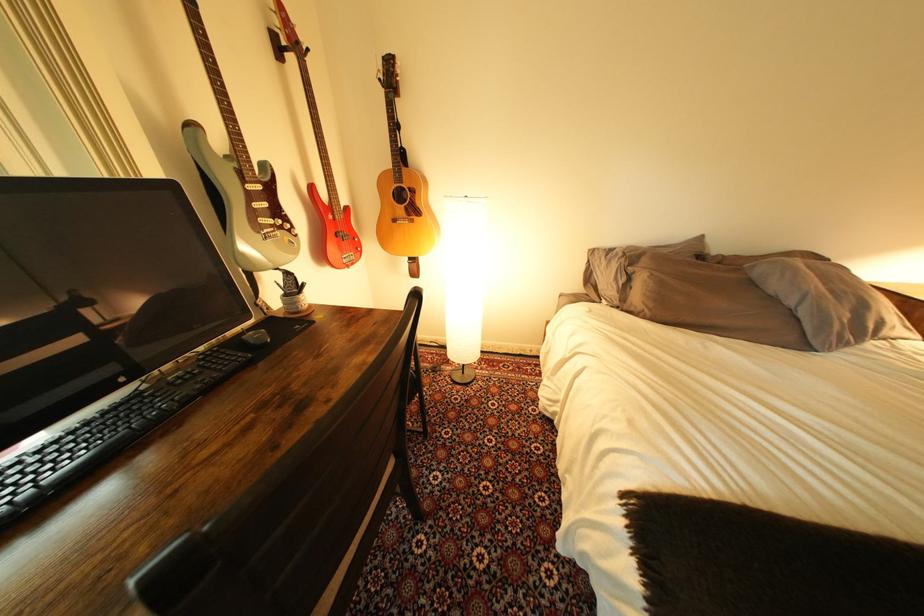
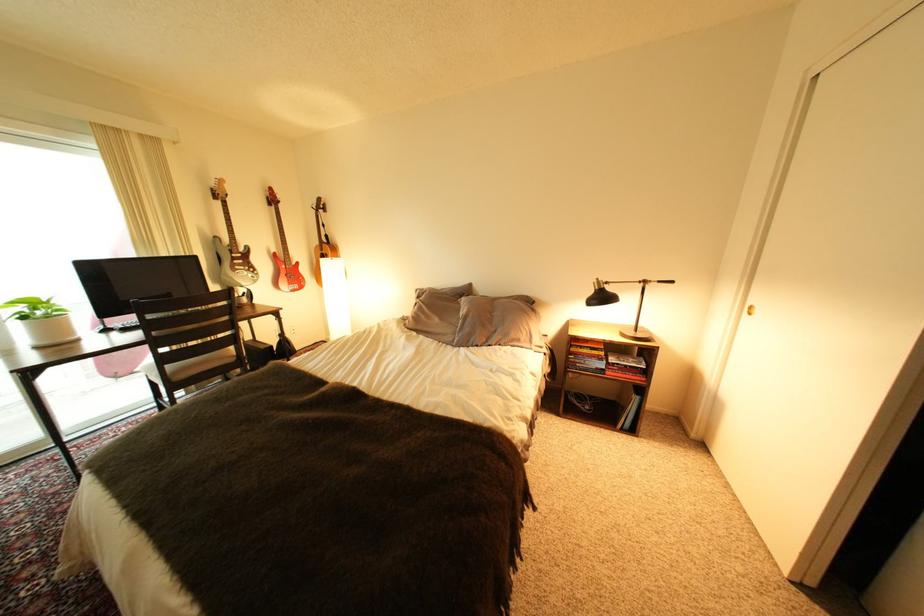
Locate, in the second image, the point that corresponds to point (324, 188) in the first image.

(286, 254)